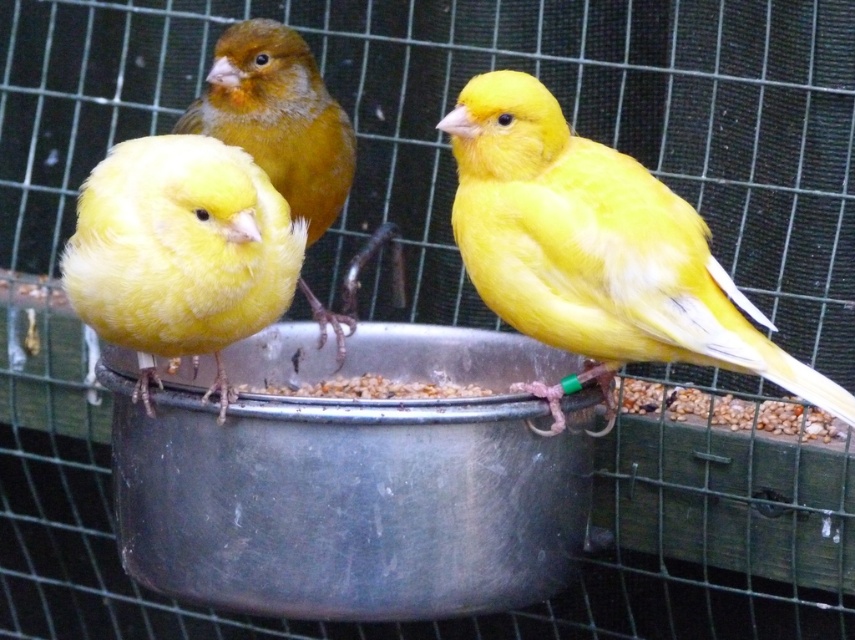
Can you confirm if matte yellow canary at center is shorter than matte yellow canary at left?

Yes, matte yellow canary at center is shorter than matte yellow canary at left.

Is matte yellow canary at center to the left of matte yellow canary at left from the viewer's perspective?

Incorrect, matte yellow canary at center is not on the left side of matte yellow canary at left.

Image resolution: width=855 pixels, height=640 pixels. Describe the element at coordinates (597, 248) in the screenshot. I see `matte yellow canary at center` at that location.

Identify the location of matte yellow canary at center. (597, 248).

Between matte yellow canary at center and yellow matte bird at center, which one is positioned lower?

Positioned lower is matte yellow canary at center.

Is point (608, 236) in front of point (216, 236)?

No, it is not.

Locate an element on the screen. Image resolution: width=855 pixels, height=640 pixels. matte yellow canary at center is located at coordinates (597, 248).

Does point (183, 179) lie behind point (323, 145)?

No, (183, 179) is in front of (323, 145).

Is point (119, 145) less distant than point (310, 192)?

Yes, point (119, 145) is closer to viewer.

Locate an element on the screen. The image size is (855, 640). yellow matte bird at center is located at coordinates (180, 252).